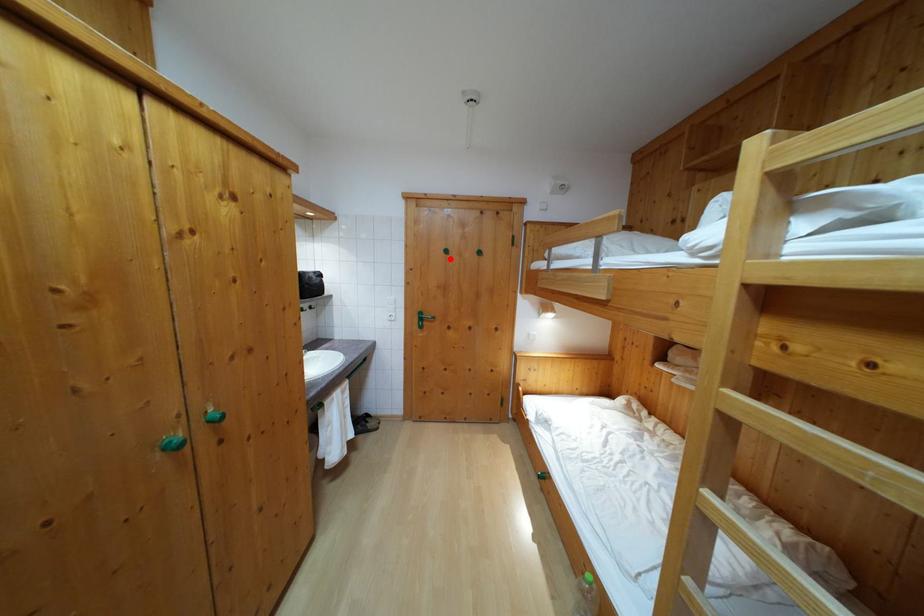
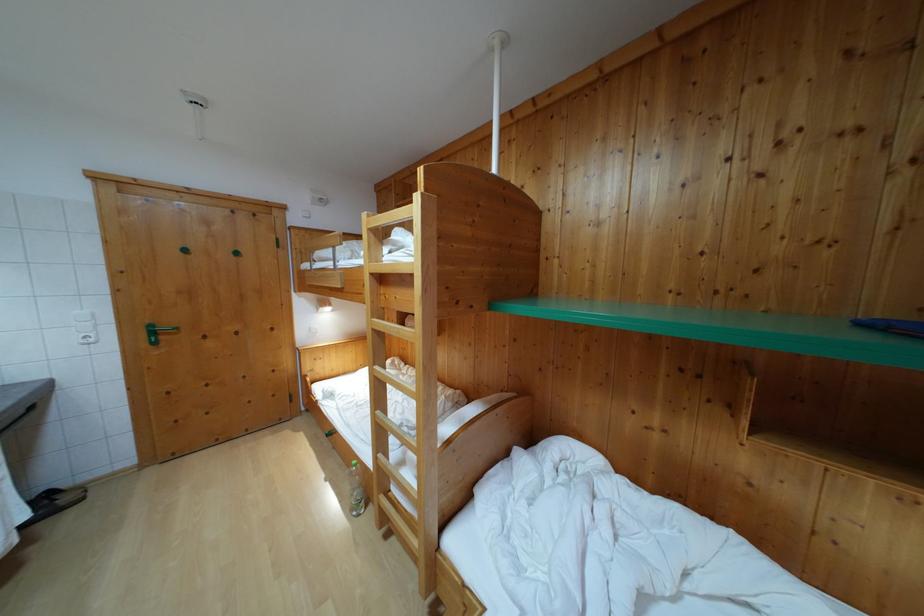
The point at the highlighted location is marked in the first image. Where is the corresponding point in the second image?

(189, 257)